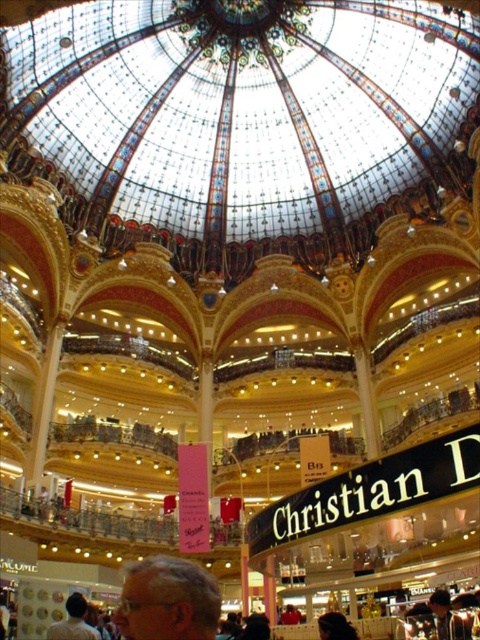
Which is behind, point (177, 593) or point (61, 625)?

Point (61, 625)

Who is positioned more to the right, light brown hair at lower center or light brown leather jacket at lower left?

light brown hair at lower center

Between point (212, 621) and point (54, 632), which one is positioned behind?

The point (54, 632) is behind.

The width and height of the screenshot is (480, 640). I want to click on light brown hair at lower center, so click(x=168, y=600).

At what (x,y) coordinates should I click in order to perform the action: click on light brown leather jacket at lower left. Please return your answer as a coordinate pair (x, y). The width and height of the screenshot is (480, 640). Looking at the image, I should click on (73, 621).

Can you confirm if light brown leather jacket at lower left is positioned to the right of smooth brown leather jacket at lower right?

In fact, light brown leather jacket at lower left is to the left of smooth brown leather jacket at lower right.

What do you see at coordinates (73, 621) in the screenshot? This screenshot has height=640, width=480. I see `light brown leather jacket at lower left` at bounding box center [73, 621].

Locate an element on the screen. The height and width of the screenshot is (640, 480). light brown leather jacket at lower left is located at coordinates (73, 621).

Is point (176, 579) positioned after point (439, 637)?

That is False.

Is light brown hair at lower center positioned behind smooth brown leather jacket at lower right?

No, it is not.

Which is in front, point (205, 595) or point (447, 627)?

Point (205, 595)

The image size is (480, 640). Find the location of `light brown hair at lower center`. light brown hair at lower center is located at coordinates (168, 600).